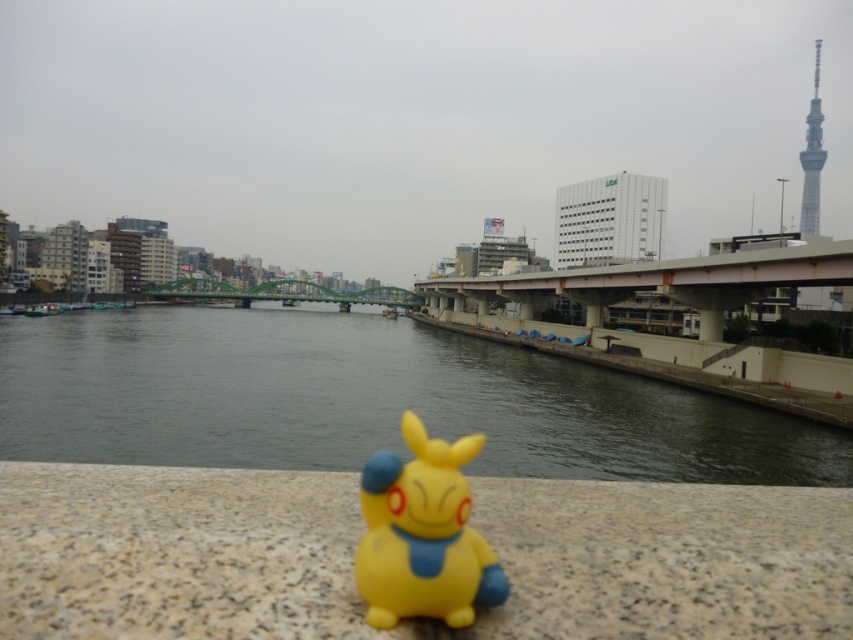
Question: Observing the image, what is the correct spatial positioning of smooth concrete river at center in reference to yellow matte pikachu at center?

Choices:
 (A) below
 (B) above

Answer: (B)

Question: Observing the image, what is the correct spatial positioning of smooth concrete river at center in reference to yellow matte pikachu at center?

Choices:
 (A) above
 (B) below

Answer: (A)

Question: Can you confirm if smooth concrete river at center is thinner than yellow matte pikachu at center?

Choices:
 (A) yes
 (B) no

Answer: (B)

Question: Which point is closer to the camera taking this photo?

Choices:
 (A) (485, 588)
 (B) (398, 396)

Answer: (A)

Question: Which point is farther to the camera?

Choices:
 (A) (463, 477)
 (B) (674, 480)

Answer: (B)

Question: Among these points, which one is nearest to the camera?

Choices:
 (A) (842, 440)
 (B) (376, 588)

Answer: (B)